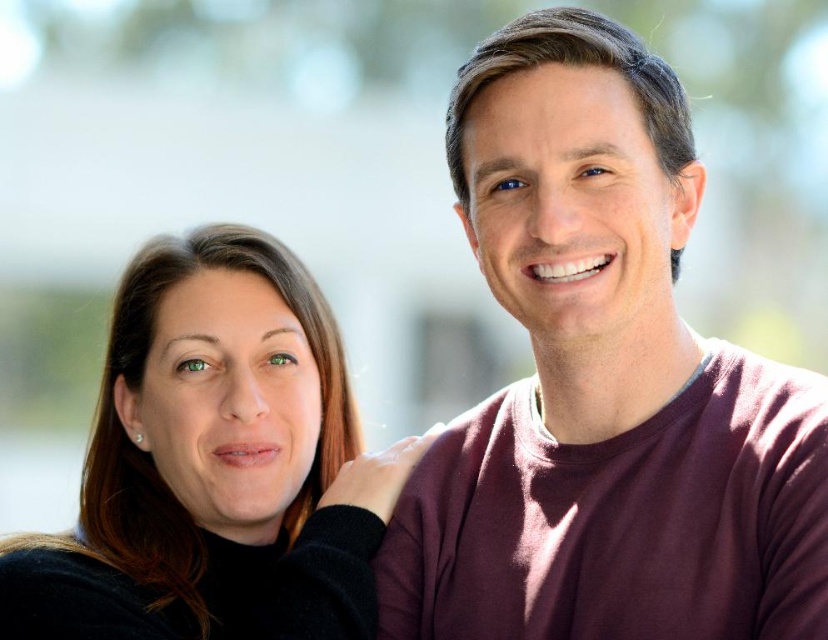
The height and width of the screenshot is (640, 828). Describe the element at coordinates (603, 384) in the screenshot. I see `maroon sweater at upper right` at that location.

Is maroon sweater at upper right closer to the viewer compared to matte black sweater at left?

Yes, it is.

Between point (599, 346) and point (263, 611), which one is positioned behind?

The point (263, 611) is more distant.

Where is `maroon sweater at upper right`? maroon sweater at upper right is located at coordinates (603, 384).